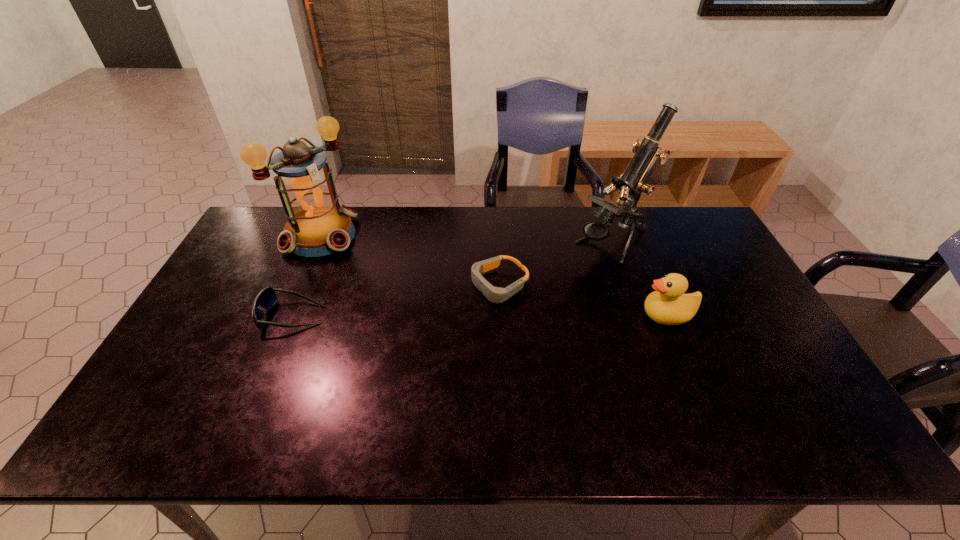
Find the location of a particular element. The width and height of the screenshot is (960, 540). sunglasses is located at coordinates (266, 298).

The width and height of the screenshot is (960, 540). I want to click on duck, so click(668, 305).

Image resolution: width=960 pixels, height=540 pixels. What are the coordinates of `microscope` in the screenshot? It's located at (631, 183).

Identify the location of lantern. The image size is (960, 540). point(318,225).

I want to click on the third object from left to right, so click(494, 294).

Where is `goggles`? The height and width of the screenshot is (540, 960). goggles is located at coordinates (494, 294).

The width and height of the screenshot is (960, 540). Identify the location of free spot located 0.080m on the front-facing side of the fourth tallest object. (232, 315).

Find the location of `free space located on the front-facing side of the fourth tallest object`. free space located on the front-facing side of the fourth tallest object is located at coordinates (236, 315).

Identify the location of blank space located 0.070m on the front-facing side of the fourth tallest object. The height and width of the screenshot is (540, 960). (236, 315).

Locate an element on the screen. vacant space located at the beak of the third shortest object is located at coordinates (x=533, y=315).